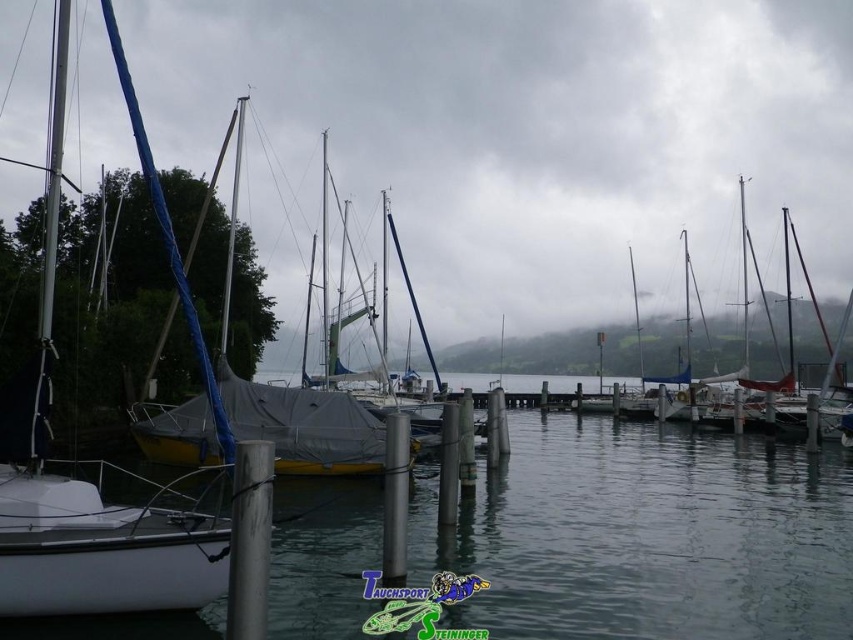
Between clear water at center and white tarpaulin sailboat at center, which one appears on the right side from the viewer's perspective?

white tarpaulin sailboat at center

Between clear water at center and white tarpaulin sailboat at center, which one is positioned higher?

white tarpaulin sailboat at center is above.

Between point (642, 632) and point (735, 371), which one is positioned behind?

The point (735, 371) is more distant.

Where is `clear water at center`? This screenshot has width=853, height=640. clear water at center is located at coordinates (648, 536).

From the picture: Who is higher up, white matte sailboat at left or white tarpaulin sailboat at center?

Positioned higher is white tarpaulin sailboat at center.

Does white matte sailboat at left have a lesser height compared to white tarpaulin sailboat at center?

Yes.

Does point (88, 534) come in front of point (830, 349)?

Yes, it is in front of point (830, 349).

Locate an element on the screen. This screenshot has width=853, height=640. white matte sailboat at left is located at coordinates (85, 492).

Is point (352, 561) positioned in front of point (85, 513)?

No, (352, 561) is further to viewer.

Which is behind, point (543, 573) or point (39, 544)?

The point (543, 573) is behind.

Who is more forward, (440,561) or (103,554)?

Positioned in front is point (103,554).

Identify the location of clear water at center. The width and height of the screenshot is (853, 640). (648, 536).